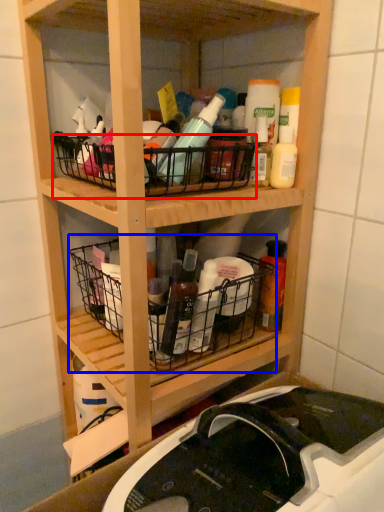
Question: Which point is closer to the camera, basket (highlighted by a red box) or basket (highlighted by a blue box)?

Choices:
 (A) basket
 (B) basket

Answer: (A)